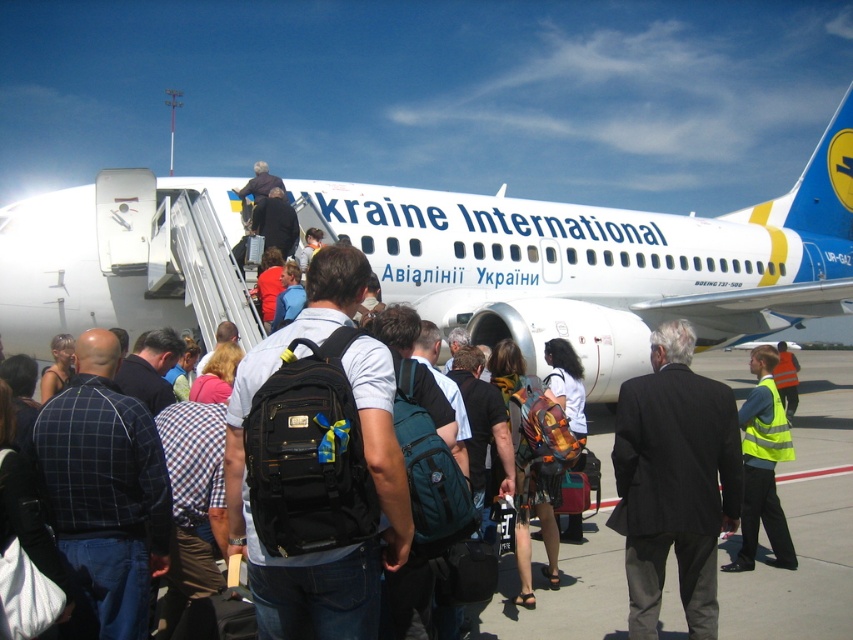
You are a passenger at the airport and see the white matte airplane at center and the dark gray suit at center. Which object is located to the left?

The white matte airplane at center is positioned on the left side of dark gray suit at center, so the white matte airplane at center is to the left of the dark gray suit at center.

You are a passenger at the airport and see the white matte airplane at center and the yellow reflective vest at center. Which object is taller?

The white matte airplane at center is taller than the yellow reflective vest at center.

You are an airport security officer observing the boarding process. You notice two individuals at the center of the scene wearing a dark gray suit at center and a yellow reflective vest at center. Which individual is standing to the left of the other?

The dark gray suit at center is positioned on the left side of yellow reflective vest at center, so the individual in the dark gray suit at center is standing to the left of the one in the yellow reflective vest at center.